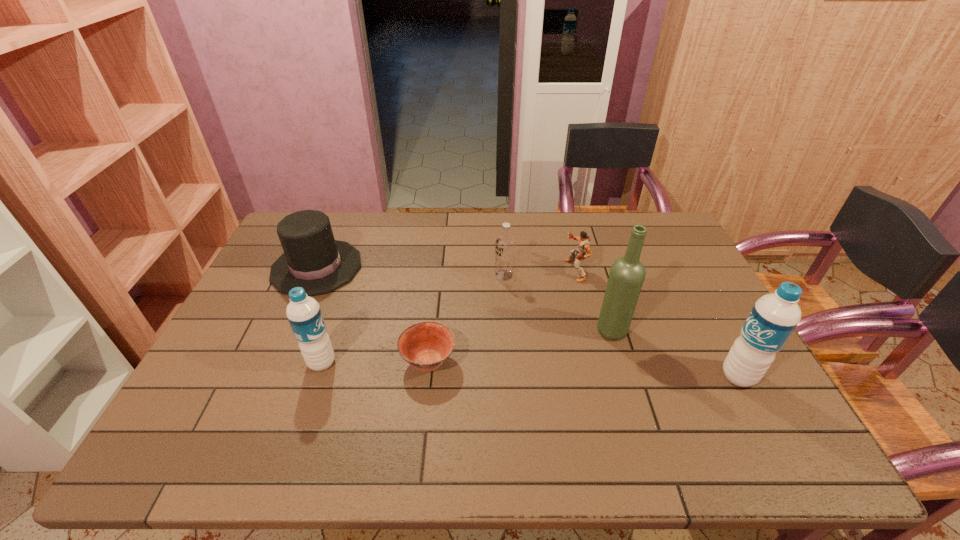
This screenshot has height=540, width=960. Identify the location of free space located 0.100m on the front label of the fourth object from right to left. (463, 275).

Identify the location of free space located 0.390m on the front label of the fourth object from right to left. (371, 275).

Identify the location of vacant space located on the back of the third object from left to right. This screenshot has width=960, height=540. (433, 321).

Find the location of a particular element. object that is at the far edge is located at coordinates (312, 259).

Find the location of a particular element. The height and width of the screenshot is (540, 960). object that is at the near edge is located at coordinates point(773,318).

Image resolution: width=960 pixels, height=540 pixels. Find the location of `object that is at the left edge`. object that is at the left edge is located at coordinates (312, 259).

I want to click on object that is positioned at the right edge, so click(773, 318).

Where is `object located in the far left corner section of the desktop`? object located in the far left corner section of the desktop is located at coordinates (312, 259).

The height and width of the screenshot is (540, 960). I want to click on object situated at the near right corner, so pos(773,318).

Image resolution: width=960 pixels, height=540 pixels. Identify the location of vacant space at the far edge of the desktop. (599, 251).